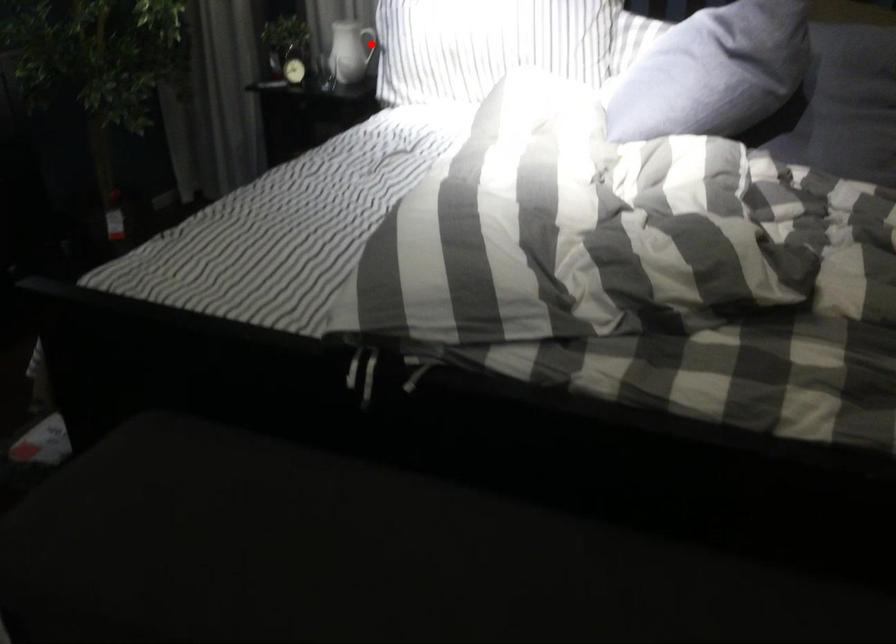
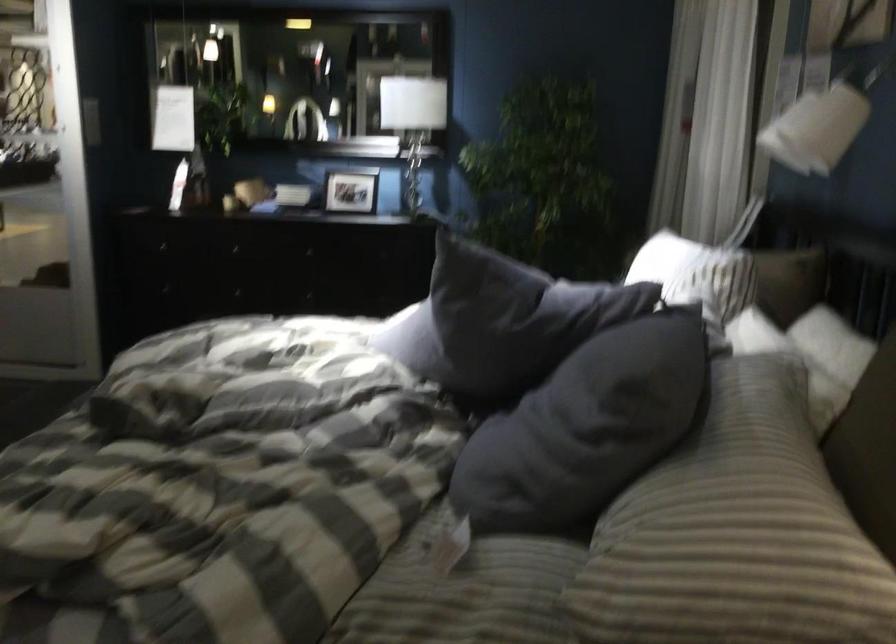
Question: I am providing you with two images of the same scene from different viewpoints. A red point is marked on the first image. Can you still see the location of the red point in image 2?

Choices:
 (A) Yes
 (B) No

Answer: (B)